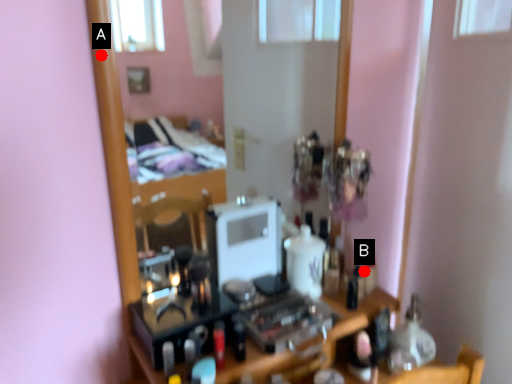
Question: Two points are circled on the image, labeled by A and B beside each circle. Which point is closer to the camera?

Choices:
 (A) A is closer
 (B) B is closer

Answer: (A)